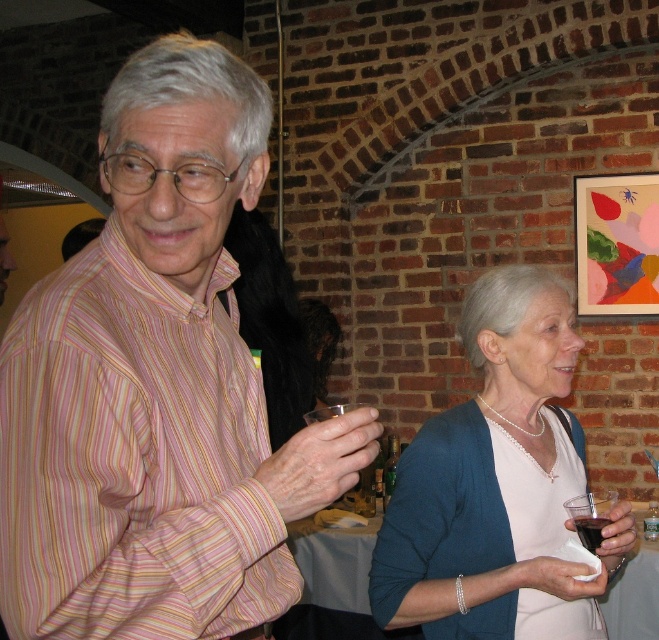
Image resolution: width=659 pixels, height=640 pixels. I want to click on pink striped shirt at left, so click(x=156, y=387).

Can you confirm if pink striped shirt at left is positioned to the right of transparent plastic cup at lower center?

No, pink striped shirt at left is not to the right of transparent plastic cup at lower center.

Does point (105, 381) come behind point (368, 506)?

That is False.

The width and height of the screenshot is (659, 640). I want to click on pink striped shirt at left, so click(x=156, y=387).

Can you confirm if pink striped shirt at left is positioned below pearl necklace at upper right?

No, pink striped shirt at left is not below pearl necklace at upper right.

Who is more forward, (111, 525) or (500, 372)?

Point (111, 525) is more forward.

Locate an element on the screen. The image size is (659, 640). pink striped shirt at left is located at coordinates (156, 387).

The height and width of the screenshot is (640, 659). I want to click on pink striped shirt at left, so click(156, 387).

Does pearl necklace at upper right lie in front of transparent plastic cup at lower right?

Yes.

Does pearl necklace at upper right have a lesser width compared to transparent plastic cup at lower right?

Incorrect, pearl necklace at upper right's width is not less than transparent plastic cup at lower right's.

The height and width of the screenshot is (640, 659). Find the location of `pearl necklace at upper right`. pearl necklace at upper right is located at coordinates (496, 483).

Where is `pearl necklace at upper right`? The image size is (659, 640). pearl necklace at upper right is located at coordinates (496, 483).